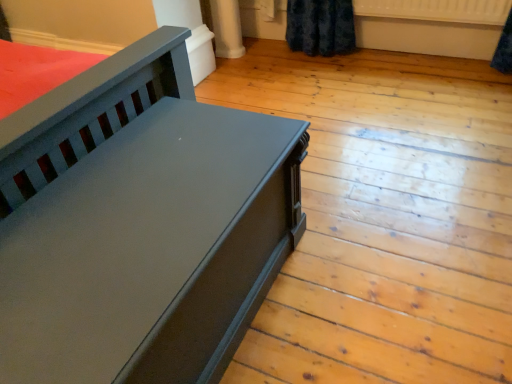
In order to face white plastic radiator at upper right, should I rotate leftwards or rightwards?

Turn right by 22.049 degrees to look at white plastic radiator at upper right.

Where is `white plastic radiator at upper right`? The width and height of the screenshot is (512, 384). white plastic radiator at upper right is located at coordinates (437, 10).

The height and width of the screenshot is (384, 512). Describe the element at coordinates (437, 10) in the screenshot. I see `white plastic radiator at upper right` at that location.

Measure the distance between point (146, 179) and camera.

The depth of point (146, 179) is 3.79 feet.

Describe the element at coordinates (139, 223) in the screenshot. I see `matte black bench at left` at that location.

Locate an element on the screen. matte black bench at left is located at coordinates (139, 223).

The width and height of the screenshot is (512, 384). In order to click on white plastic radiator at upper right in this screenshot , I will do `click(437, 10)`.

Is matte black bench at left to the left or to the right of white plastic radiator at upper right in the image?

matte black bench at left is positioned on white plastic radiator at upper right's left side.

In the image, is matte black bench at left positioned in front of or behind white plastic radiator at upper right?

In the image, matte black bench at left appears in front of white plastic radiator at upper right.

Considering the positions of point (212, 305) and point (395, 17), is point (212, 305) closer or farther from the camera than point (395, 17)?

Point (212, 305) appears to be closer to the viewer than point (395, 17).

From the image's perspective, is matte black bench at left above or below white plastic radiator at upper right?

matte black bench at left is situated lower than white plastic radiator at upper right in the image.

From a real-world perspective, is matte black bench at left positioned above or below white plastic radiator at upper right?

matte black bench at left is below white plastic radiator at upper right.

Considering the relative sizes of matte black bench at left and white plastic radiator at upper right in the image provided, is matte black bench at left wider than white plastic radiator at upper right?

Yes.

Who is taller, matte black bench at left or white plastic radiator at upper right?

matte black bench at left.

Looking at the image, does matte black bench at left seem bigger or smaller compared to white plastic radiator at upper right?

Clearly, matte black bench at left is larger in size than white plastic radiator at upper right.

Would you say matte black bench at left is outside white plastic radiator at upper right?

Indeed, matte black bench at left is completely outside white plastic radiator at upper right.

Would you say matte black bench at left is a long distance from white plastic radiator at upper right?

Yes.

Is matte black bench at left turned away from white plastic radiator at upper right?

That's not correct — matte black bench at left is not looking away from white plastic radiator at upper right.

Can you tell me how much matte black bench at left and white plastic radiator at upper right differ in facing direction?

matte black bench at left and white plastic radiator at upper right are facing 89.5 degrees away from each other.

Locate an element on the screen. radiator behind the matte black bench at left is located at coordinates (437, 10).

Visually, is white plastic radiator at upper right positioned to the left or to the right of matte black bench at left?

Clearly, white plastic radiator at upper right is on the right of matte black bench at left in the image.

Who is more distant, white plastic radiator at upper right or matte black bench at left?

white plastic radiator at upper right is more distant.

Considering the positions of point (478, 11) and point (25, 137), is point (478, 11) closer or farther from the camera than point (25, 137)?

Point (478, 11) appears to be farther away from the viewer than point (25, 137).

From the image's perspective, is white plastic radiator at upper right above matte black bench at left?

Indeed, from the image's perspective, white plastic radiator at upper right is shown above matte black bench at left.

From a real-world perspective, which object stands above the other?

white plastic radiator at upper right.

In the scene shown: Which object is thinner, white plastic radiator at upper right or matte black bench at left?

white plastic radiator at upper right is thinner.

Between white plastic radiator at upper right and matte black bench at left, which one has more height?

With more height is matte black bench at left.

Which of these two, white plastic radiator at upper right or matte black bench at left, is smaller?

white plastic radiator at upper right is smaller.

Can we say white plastic radiator at upper right lies outside matte black bench at left?

Yes.

Is white plastic radiator at upper right directly adjacent to matte black bench at left?

white plastic radiator at upper right is not next to matte black bench at left, and they're not touching.

Does white plastic radiator at upper right turn towards matte black bench at left?

Yes.

This screenshot has height=384, width=512. I want to click on radiator located above the matte black bench at left (from a real-world perspective), so click(x=437, y=10).

Locate an element on the screen. This screenshot has height=384, width=512. furniture that appears below the white plastic radiator at upper right (from the image's perspective) is located at coordinates (139, 223).

At what (x,y) coordinates should I click in order to perform the action: click on furniture on the left of the white plastic radiator at upper right. Please return your answer as a coordinate pair (x, y). Looking at the image, I should click on (139, 223).